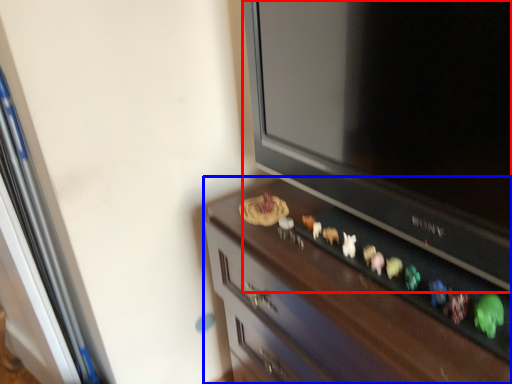
Question: Which object is further to the camera taking this photo, television (highlighted by a red box) or furniture (highlighted by a blue box)?

Choices:
 (A) television
 (B) furniture

Answer: (B)